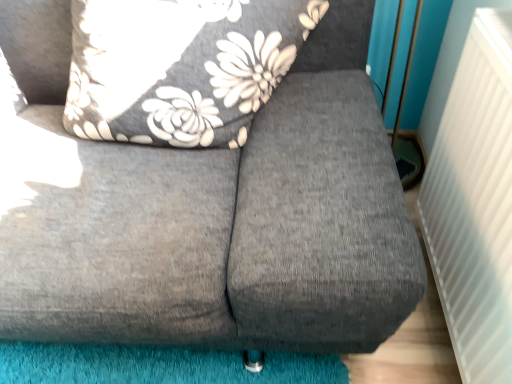
The height and width of the screenshot is (384, 512). Describe the element at coordinates (180, 67) in the screenshot. I see `floral fabric pillow at upper left` at that location.

I want to click on floral fabric pillow at upper left, so pos(180,67).

Measure the distance between point (x=96, y=29) and camera.

A distance of 1.13 meters exists between point (x=96, y=29) and camera.

The width and height of the screenshot is (512, 384). What are the coordinates of `floral fabric pillow at upper left` in the screenshot? It's located at (180, 67).